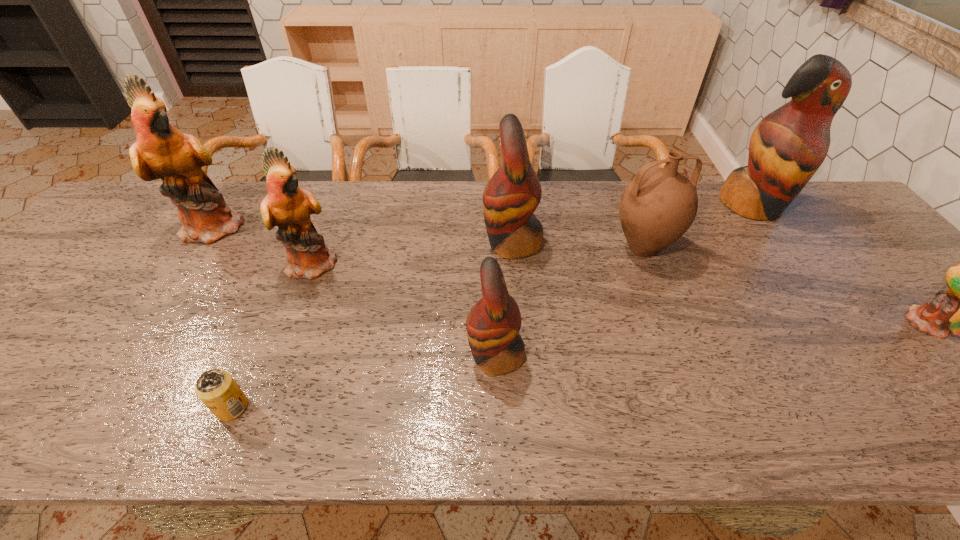
In order to click on the nearest object in this screenshot , I will do `click(217, 389)`.

At what (x,y) coordinates should I click in order to perform the action: click on beer can. Please return your answer as a coordinate pair (x, y). This screenshot has height=540, width=960. Looking at the image, I should click on (217, 389).

The width and height of the screenshot is (960, 540). What are the coordinates of `vacant region located 0.240m on the front-facing side of the biggest green parrot` in the screenshot? It's located at (329, 226).

At what (x,y) coordinates should I click in order to perform the action: click on vacant space located 0.050m on the face of the second object from right to left. Please return your answer as a coordinate pair (x, y). This screenshot has width=960, height=540. Looking at the image, I should click on (775, 239).

Where is `vacant space situated 0.190m on the face of the second smallest red parrot`? The height and width of the screenshot is (540, 960). vacant space situated 0.190m on the face of the second smallest red parrot is located at coordinates (414, 243).

Locate an element on the screen. vacant region located 0.310m on the face of the second smallest red parrot is located at coordinates (371, 243).

I want to click on vacant space positioned 0.270m on the face of the second smallest red parrot, so click(385, 243).

Identify the location of vacant space situated on the front-facing side of the second green parrot from left to right. (390, 263).

You are a GUI agent. You are given a task and a screenshot of the screen. Output one action in this format:
    pyautogui.click(x=<x>, y=<y>)
    Task: Click on the free location located on the left of the brown pitcher
    The image size is (960, 540).
    Given the screenshot: What is the action you would take?
    pyautogui.click(x=577, y=248)

Identify the location of vacant area situated on the face of the nearest red parrot. (x=381, y=356).